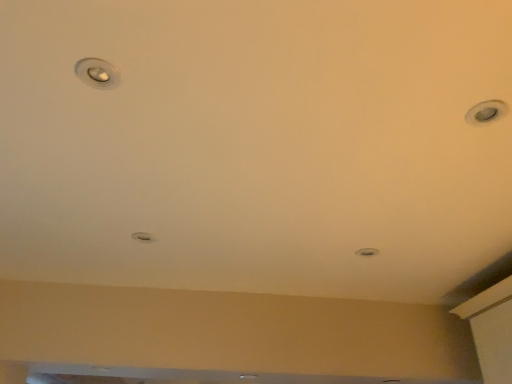
Question: Is matte silver droplight at upper left, marked as the 1th droplight in a top-to-bottom arrangement, situated inside matte silver light at center or outside?

Choices:
 (A) outside
 (B) inside

Answer: (A)

Question: Is matte silver droplight at upper left, the 1th droplight from the right, taller or shorter than matte silver light at center?

Choices:
 (A) tall
 (B) short

Answer: (B)

Question: Considering the real-world distances, which object is farthest from the matte silver droplight at center, the 1th droplight in the left-to-right sequence?

Choices:
 (A) matte silver light at center
 (B) matte silver droplight at upper left, the second droplight from the left

Answer: (A)

Question: Which object is positioned farthest from the matte silver light at center?

Choices:
 (A) matte silver droplight at upper left, marked as the first droplight in a front-to-back arrangement
 (B) matte silver droplight at center, acting as the first droplight starting from the back

Answer: (A)